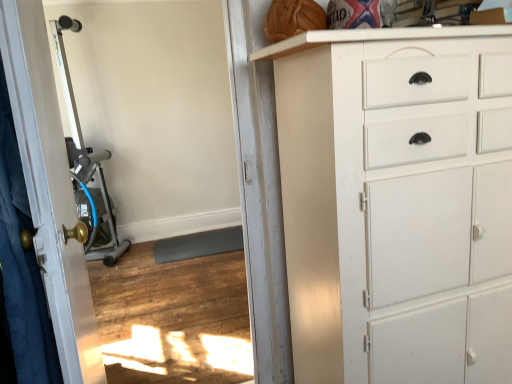
Locate an element on the screen. The width and height of the screenshot is (512, 384). silver metallic exercise machine at left is located at coordinates (87, 165).

Locate an element on the screen. silver metallic exercise machine at left is located at coordinates (50, 187).

The height and width of the screenshot is (384, 512). What are the coordinates of `white glossy door at left` in the screenshot? It's located at (49, 188).

Locate an element on the screen. This screenshot has height=384, width=512. white painted wood chest of drawers at right is located at coordinates (391, 194).

From the image's perspective, is white glossy door at left beneath silver metallic exercise machine at left?

Yes, from the image's perspective, white glossy door at left is beneath silver metallic exercise machine at left.

Consider the image. Is white glossy door at left to the left of silver metallic exercise machine at left from the viewer's perspective?

Yes, white glossy door at left is to the left of silver metallic exercise machine at left.

Does white glossy door at left touch silver metallic exercise machine at left?

Yes, white glossy door at left is with silver metallic exercise machine at left.

From a real-world perspective, which object rests below the other?

silver metallic exercise machine at left.

Measure the distance from white painted wood chest of drawers at right to silver metallic exercise machine at left.

white painted wood chest of drawers at right is 85.14 centimeters from silver metallic exercise machine at left.

In terms of width, does white painted wood chest of drawers at right look wider or thinner when compared to silver metallic exercise machine at left?

In the image, white painted wood chest of drawers at right appears to be wider than silver metallic exercise machine at left.

From the image's perspective, is white painted wood chest of drawers at right located beneath silver metallic exercise machine at left?

Yes.

Is white painted wood chest of drawers at right far from silver metallic exercise machine at left?

No, white painted wood chest of drawers at right is not far away from silver metallic exercise machine at left.

Could you tell me if white glossy door at left is turned towards silver metallic exercise machine at left?

No, white glossy door at left is not oriented towards silver metallic exercise machine at left.

Are white glossy door at left and silver metallic exercise machine at left far apart?

That's right, there is a large distance between white glossy door at left and silver metallic exercise machine at left.

Is the depth of white glossy door at left greater than that of silver metallic exercise machine at left?

No, it is in front of silver metallic exercise machine at left.

How many degrees apart are the facing directions of white glossy door at left and silver metallic exercise machine at left?

The angular difference between white glossy door at left and silver metallic exercise machine at left is 92.9 degrees.

Is silver metallic exercise machine at left taller than silver metallic exercise machine at left?

Incorrect, the height of silver metallic exercise machine at left is not larger of that of silver metallic exercise machine at left.

Could you tell me if silver metallic exercise machine at left is facing silver metallic exercise machine at left?

No, silver metallic exercise machine at left does not turn towards silver metallic exercise machine at left.

Considering the sizes of objects silver metallic exercise machine at left and silver metallic exercise machine at left in the image provided, who is bigger, silver metallic exercise machine at left or silver metallic exercise machine at left?

silver metallic exercise machine at left.

How far apart are silver metallic exercise machine at left and silver metallic exercise machine at left?

7.34 feet.

Does silver metallic exercise machine at left have a lesser height compared to white glossy door at left?

No, silver metallic exercise machine at left is not shorter than white glossy door at left.

Does point (53, 249) come farther from viewer compared to point (100, 369)?

No, (53, 249) is closer to viewer.

Is silver metallic exercise machine at left thinner than white glossy door at left?

Indeed, silver metallic exercise machine at left has a lesser width compared to white glossy door at left.

From the image's perspective, is silver metallic exercise machine at left positioned above or below white glossy door at left?

Based on their image positions, silver metallic exercise machine at left is located above white glossy door at left.

From a real-world perspective, is silver metallic exercise machine at left on white painted wood chest of drawers at right?

Yes, from a real-world perspective, silver metallic exercise machine at left is over white painted wood chest of drawers at right

From the image's perspective, is silver metallic exercise machine at left over white painted wood chest of drawers at right?

Yes.

Is silver metallic exercise machine at left taller or shorter than white painted wood chest of drawers at right?

In the image, silver metallic exercise machine at left appears to be taller than white painted wood chest of drawers at right.

Is silver metallic exercise machine at left not within white painted wood chest of drawers at right?

That's correct, silver metallic exercise machine at left is outside of white painted wood chest of drawers at right.

From the image's perspective, between silver metallic exercise machine at left and white painted wood chest of drawers at right, which one is located above?

silver metallic exercise machine at left.

Is silver metallic exercise machine at left at the right side of white painted wood chest of drawers at right?

Incorrect, silver metallic exercise machine at left is not on the right side of white painted wood chest of drawers at right.

How much distance is there between silver metallic exercise machine at left and white painted wood chest of drawers at right?

8.28 feet.

Considering the relative sizes of silver metallic exercise machine at left and white painted wood chest of drawers at right in the image provided, is silver metallic exercise machine at left shorter than white painted wood chest of drawers at right?

No.

You are a GUI agent. You are given a task and a screenshot of the screen. Output one action in this format:
    pyautogui.click(x=<x>, y=<y>)
    Task: Click on the screen door below the white glossy door at left (from a real-world perspective)
    The width and height of the screenshot is (512, 384).
    Given the screenshot: What is the action you would take?
    pyautogui.click(x=50, y=187)

The width and height of the screenshot is (512, 384). Identify the location of screen door above the white painted wood chest of drawers at right (from a real-world perspective). (50, 187).

Which object lies nearer to the anchor point silver metallic exercise machine at left, white painted wood chest of drawers at right or white glossy door at left?

Based on the image, white glossy door at left appears to be nearer to silver metallic exercise machine at left.

Considering their positions, is silver metallic exercise machine at left positioned further to silver metallic exercise machine at left than white painted wood chest of drawers at right?

silver metallic exercise machine at left.

Considering their positions, is silver metallic exercise machine at left positioned further to white glossy door at left than silver metallic exercise machine at left?

silver metallic exercise machine at left lies further to white glossy door at left than the other object.

In the scene shown: Estimate the real-world distances between objects in this image. Which object is further from silver metallic exercise machine at left, silver metallic exercise machine at left or white glossy door at left?

silver metallic exercise machine at left is further to silver metallic exercise machine at left.

Looking at the image, which one is located closer to silver metallic exercise machine at left, silver metallic exercise machine at left or white painted wood chest of drawers at right?

Based on the image, silver metallic exercise machine at left appears to be nearer to silver metallic exercise machine at left.

When comparing their distances from silver metallic exercise machine at left, does white painted wood chest of drawers at right or silver metallic exercise machine at left seem further?

Based on the image, silver metallic exercise machine at left appears to be further to silver metallic exercise machine at left.

Estimate the real-world distances between objects in this image. Which object is further from white glossy door at left, white painted wood chest of drawers at right or silver metallic exercise machine at left?

white painted wood chest of drawers at right is positioned further to the anchor white glossy door at left.

Considering their positions, is white painted wood chest of drawers at right positioned further to white glossy door at left than silver metallic exercise machine at left?

Among the two, silver metallic exercise machine at left is located further to white glossy door at left.

Identify the location of screen door between white glossy door at left and silver metallic exercise machine at left along the z-axis. (50, 187).

Where is `screen door located between white painted wood chest of drawers at right and silver metallic exercise machine at left in the depth direction`? screen door located between white painted wood chest of drawers at right and silver metallic exercise machine at left in the depth direction is located at coordinates (50, 187).

Where is `chest of drawers between white glossy door at left and silver metallic exercise machine at left from front to back`? chest of drawers between white glossy door at left and silver metallic exercise machine at left from front to back is located at coordinates (391, 194).

The width and height of the screenshot is (512, 384). Find the location of `screen door situated between white glossy door at left and white painted wood chest of drawers at right from left to right`. screen door situated between white glossy door at left and white painted wood chest of drawers at right from left to right is located at coordinates point(50,187).